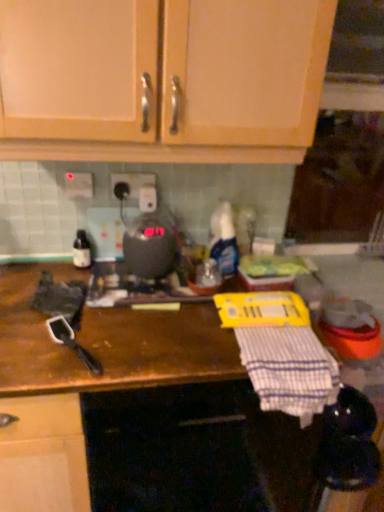
Identify the location of vacant area situated to the left side of matte glass bottle at left, which is the second bottle in right-to-left order. The image size is (384, 512). (36, 273).